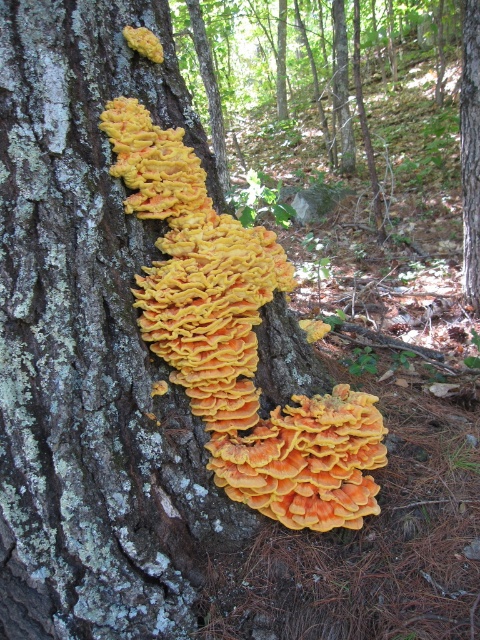
Question: Is orange soft coral at center thinner than smooth bark tree trunk at center?

Choices:
 (A) yes
 (B) no

Answer: (B)

Question: In this image, where is orange soft coral at center located relative to smooth bark tree trunk at center?

Choices:
 (A) right
 (B) left

Answer: (B)

Question: Is orange soft coral at center thinner than smooth bark tree trunk at center?

Choices:
 (A) no
 (B) yes

Answer: (A)

Question: Which point is farther to the camera?

Choices:
 (A) orange soft coral at center
 (B) smooth bark tree trunk at center

Answer: (B)

Question: Which point is closer to the camera?

Choices:
 (A) smooth bark tree trunk at center
 (B) orange soft coral at center

Answer: (B)

Question: Which object is farther from the camera taking this photo?

Choices:
 (A) orange soft coral at center
 (B) smooth bark tree trunk at center

Answer: (B)